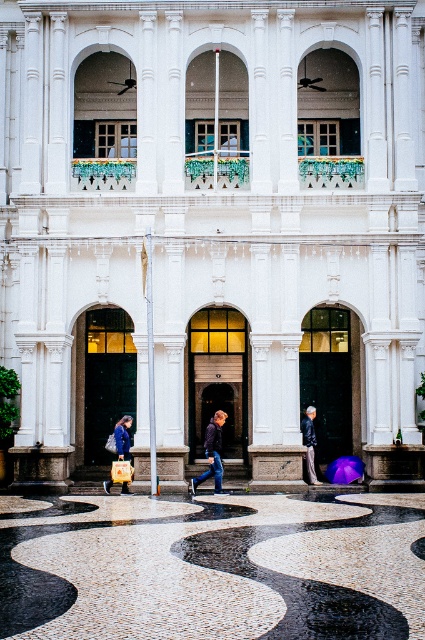
Is denim jacket at center to the right of blue denim jacket at lower left from the viewer's perspective?

Yes, denim jacket at center is to the right of blue denim jacket at lower left.

Which is below, denim jacket at center or blue denim jacket at lower left?

denim jacket at center is below.

Is point (221, 490) in front of point (124, 492)?

Yes, it is.

Locate an element on the screen. This screenshot has width=425, height=640. denim jacket at center is located at coordinates (212, 452).

Can you confirm if denim jacket at center is taller than transparent purple umbrella at center?

In fact, denim jacket at center may be shorter than transparent purple umbrella at center.

Identify the location of denim jacket at center. (212, 452).

Between point (217, 417) and point (339, 468), which one is positioned behind?

The point (339, 468) is behind.

Where is `denim jacket at center`? The height and width of the screenshot is (640, 425). denim jacket at center is located at coordinates coord(212,452).

Does denim jacket at center lie behind leather jacket at lower center?

No, denim jacket at center is closer to the viewer.

Is point (212, 432) closer to viewer compared to point (311, 481)?

Yes, point (212, 432) is closer to viewer.

This screenshot has height=640, width=425. Identify the location of denim jacket at center. (212, 452).